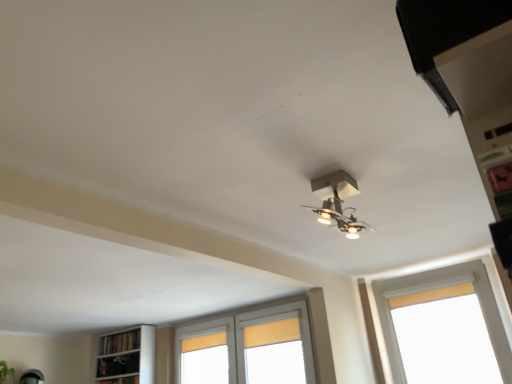
The height and width of the screenshot is (384, 512). Describe the element at coordinates (243, 336) in the screenshot. I see `white wooden window at center, the second window viewed from the front` at that location.

Image resolution: width=512 pixels, height=384 pixels. Identify the location of white wooden window at center, acting as the 1th window starting from the left. (243, 336).

What is the approximate width of white painted wood window at right, the 2th window in the left-to-right sequence?

The width of white painted wood window at right, the 2th window in the left-to-right sequence, is 21.35 centimeters.

Where is `white painted wood window at right, which is the first window in front-to-back order`? white painted wood window at right, which is the first window in front-to-back order is located at coordinates (x=443, y=287).

What do you see at coordinates (445, 33) in the screenshot?
I see `black matte exhaust hood at upper right` at bounding box center [445, 33].

This screenshot has height=384, width=512. I want to click on metallic silver light fixture at center, so click(x=337, y=202).

From the image's perspective, does white wooden window at center, positioned as the second window in right-to-left order, appear higher than wooden bookshelf at lower left?

Indeed, from the image's perspective, white wooden window at center, positioned as the second window in right-to-left order, is shown above wooden bookshelf at lower left.

Is white wooden window at center, acting as the 1th window starting from the left, facing away from wooden bookshelf at lower left?

No, wooden bookshelf at lower left is not at the back of white wooden window at center, acting as the 1th window starting from the left.

Considering the sizes of objects white wooden window at center, acting as the 1th window starting from the left, and wooden bookshelf at lower left in the image provided, who is taller, white wooden window at center, acting as the 1th window starting from the left, or wooden bookshelf at lower left?

white wooden window at center, acting as the 1th window starting from the left.

From a real-world perspective, relative to wooden bookshelf at lower left, is white wooden window at center, acting as the 1th window starting from the left, vertically above or below?

white wooden window at center, acting as the 1th window starting from the left, is below wooden bookshelf at lower left.

Can you see black matte exhaust hood at upper right touching white painted wood window at right, the 2th window from the back?

No.

Is black matte exhaust hood at upper right facing away from white painted wood window at right, arranged as the 1th window when viewed from the right?

Yes.

Based on the photo, does black matte exhaust hood at upper right come in front of white painted wood window at right, which is the first window in front-to-back order?

That is True.

Which is more to the left, black matte exhaust hood at upper right or metallic silver light fixture at center?

black matte exhaust hood at upper right is more to the left.

From the image's perspective, which one is positioned higher, black matte exhaust hood at upper right or metallic silver light fixture at center?

black matte exhaust hood at upper right, from the image's perspective.

What's the angular difference between black matte exhaust hood at upper right and metallic silver light fixture at center's facing directions?

0.634 degrees separate the facing orientations of black matte exhaust hood at upper right and metallic silver light fixture at center.

Does wooden bookshelf at lower left contain black matte exhaust hood at upper right?

No, black matte exhaust hood at upper right is not surrounded by wooden bookshelf at lower left.

Who is taller, wooden bookshelf at lower left or black matte exhaust hood at upper right?

Standing taller between the two is wooden bookshelf at lower left.

Based on their positions, is wooden bookshelf at lower left located to the left or right of black matte exhaust hood at upper right?

wooden bookshelf at lower left is positioned on black matte exhaust hood at upper right's left side.

From the image's perspective, between white painted wood window at right, arranged as the 1th window when viewed from the right, and white wooden window at center, positioned as the second window in right-to-left order, which one is located above?

white painted wood window at right, arranged as the 1th window when viewed from the right, is shown above in the image.

Does white painted wood window at right, arranged as the 1th window when viewed from the right, have a greater width compared to white wooden window at center, acting as the 1th window starting from the left?

Correct, the width of white painted wood window at right, arranged as the 1th window when viewed from the right, exceeds that of white wooden window at center, acting as the 1th window starting from the left.

Could you tell me if white painted wood window at right, arranged as the 1th window when viewed from the right, is turned towards white wooden window at center, which is the 1th window in back-to-front order?

No, white painted wood window at right, arranged as the 1th window when viewed from the right, does not turn towards white wooden window at center, which is the 1th window in back-to-front order.

Between point (328, 205) and point (117, 352), which one is positioned behind?

Positioned behind is point (117, 352).

Could you tell me if metallic silver light fixture at center is facing wooden bookshelf at lower left?

No, metallic silver light fixture at center is not aimed at wooden bookshelf at lower left.

Is metallic silver light fixture at center positioned before wooden bookshelf at lower left?

Yes, metallic silver light fixture at center is in front of wooden bookshelf at lower left.

Could wooden bookshelf at lower left be considered to be inside metallic silver light fixture at center?

No, metallic silver light fixture at center does not contain wooden bookshelf at lower left.

From a real-world perspective, which is physically above, black matte exhaust hood at upper right or white wooden window at center, acting as the 1th window starting from the left?

black matte exhaust hood at upper right is physically above.

Between point (400, 6) and point (247, 317), which one is positioned behind?

The point (247, 317) is farther from the camera.

Looking at the image, does black matte exhaust hood at upper right seem bigger or smaller compared to white wooden window at center, the second window viewed from the front?

Considering their sizes, black matte exhaust hood at upper right takes up less space than white wooden window at center, the second window viewed from the front.

Is black matte exhaust hood at upper right far from white wooden window at center, positioned as the second window in right-to-left order?

black matte exhaust hood at upper right is far away from white wooden window at center, positioned as the second window in right-to-left order.

At what (x,y) coordinates should I click in order to perform the action: click on the 1st window counting from the right of the wooden bookshelf at lower left. Please return your answer as a coordinate pair (x, y). The width and height of the screenshot is (512, 384). Looking at the image, I should click on (x=243, y=336).

From the image's perspective, which window is the 1st one below the black matte exhaust hood at upper right? Please provide its 2D coordinates.

[(443, 287)]

Estimate the real-world distances between objects in this image. Which object is closer to white painted wood window at right, the 2th window in the left-to-right sequence, metallic silver light fixture at center or wooden bookshelf at lower left?

metallic silver light fixture at center is positioned closer to the anchor white painted wood window at right, the 2th window in the left-to-right sequence.

Based on their spatial positions, is metallic silver light fixture at center or white painted wood window at right, which is the first window in front-to-back order, further from black matte exhaust hood at upper right?

The object further to black matte exhaust hood at upper right is white painted wood window at right, which is the first window in front-to-back order.

In the scene shown: When comparing their distances from wooden bookshelf at lower left, does black matte exhaust hood at upper right or white painted wood window at right, which is the first window in front-to-back order, seem further?

Among the two, black matte exhaust hood at upper right is located further to wooden bookshelf at lower left.

When comparing their distances from white wooden window at center, acting as the 1th window starting from the left, does wooden bookshelf at lower left or white painted wood window at right, the 2th window in the left-to-right sequence, seem further?

white painted wood window at right, the 2th window in the left-to-right sequence.

When comparing their distances from wooden bookshelf at lower left, does black matte exhaust hood at upper right or metallic silver light fixture at center seem further?

Among the two, black matte exhaust hood at upper right is located further to wooden bookshelf at lower left.

When comparing their distances from white painted wood window at right, the 2th window from the back, does black matte exhaust hood at upper right or metallic silver light fixture at center seem closer?

metallic silver light fixture at center is positioned closer to the anchor white painted wood window at right, the 2th window from the back.

When comparing their distances from black matte exhaust hood at upper right, does white painted wood window at right, which is the first window in front-to-back order, or metallic silver light fixture at center seem further?

white painted wood window at right, which is the first window in front-to-back order, is positioned further to the anchor black matte exhaust hood at upper right.

Based on their spatial positions, is white wooden window at center, which is the 1th window in back-to-front order, or wooden bookshelf at lower left closer to metallic silver light fixture at center?

white wooden window at center, which is the 1th window in back-to-front order, lies closer to metallic silver light fixture at center than the other object.

Find the location of a particular element. This screenshot has width=512, height=384. lamp positioned between black matte exhaust hood at upper right and wooden bookshelf at lower left from near to far is located at coordinates (337, 202).

I want to click on window between wooden bookshelf at lower left and white painted wood window at right, which is the first window in front-to-back order, from left to right, so click(x=243, y=336).

This screenshot has height=384, width=512. I want to click on lamp between black matte exhaust hood at upper right and white painted wood window at right, the 2th window from the back, from front to back, so click(x=337, y=202).

Where is `window located between metallic silver light fixture at center and white wooden window at center, positioned as the second window in right-to-left order, in the depth direction`? The height and width of the screenshot is (384, 512). window located between metallic silver light fixture at center and white wooden window at center, positioned as the second window in right-to-left order, in the depth direction is located at coordinates (443, 287).